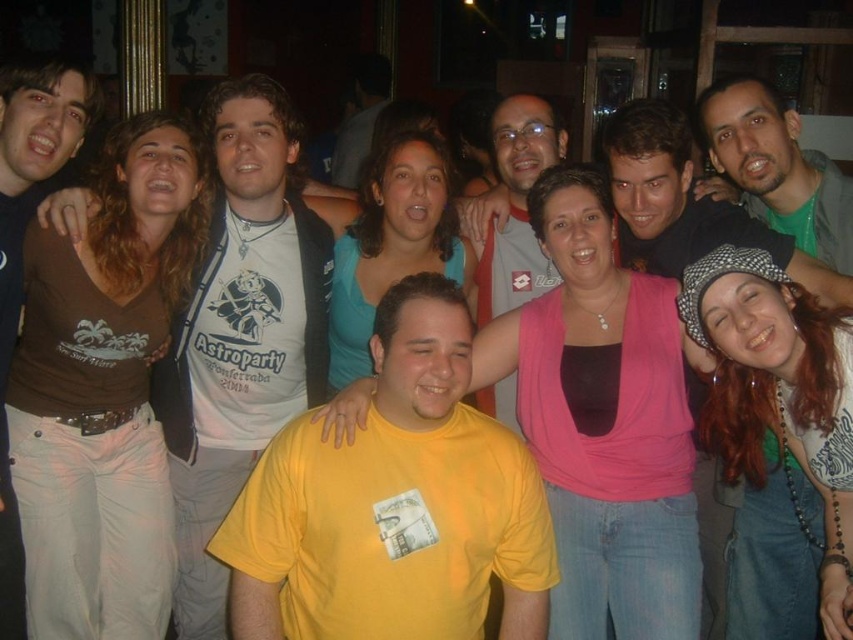
Question: Which object appears closest to the camera in this image?

Choices:
 (A) matte white t-shirt at center
 (B) beige fabric cap at right

Answer: (B)

Question: Which point is closer to the camera taking this photo?

Choices:
 (A) (624, 250)
 (B) (426, 422)
 (C) (744, 148)
 (D) (503, 300)

Answer: (B)

Question: Is matte white t-shirt at center further to camera compared to green t-shirt at center?

Choices:
 (A) yes
 (B) no

Answer: (A)

Question: Does green t-shirt at center appear over matte gray shirt at center?

Choices:
 (A) yes
 (B) no

Answer: (B)

Question: Which of the following is the farthest from the observer?

Choices:
 (A) matte gray shirt at center
 (B) matte white t-shirt at center
 (C) beige fabric cap at right

Answer: (A)

Question: Does brown cotton shirt at left come in front of beige fabric cap at right?

Choices:
 (A) yes
 (B) no

Answer: (A)